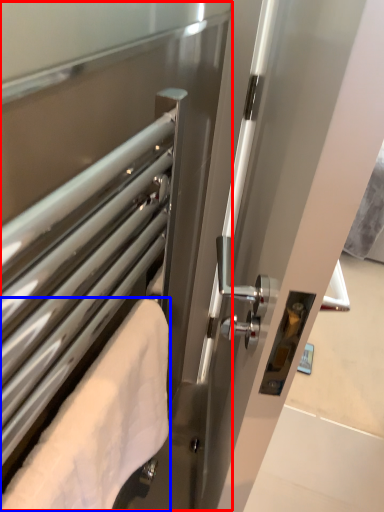
Question: Which of the following is the closest to the observer, screen door (highlighted by a red box) or towel (highlighted by a blue box)?

Choices:
 (A) screen door
 (B) towel

Answer: (A)